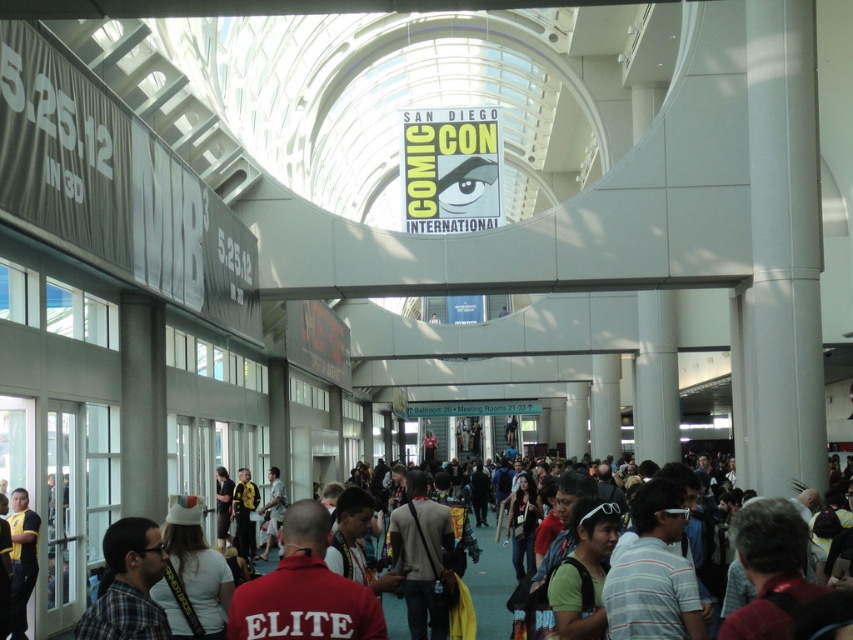
Who is positioned more to the right, plaid shirt at lower left or yellow jersey at center?

From the viewer's perspective, plaid shirt at lower left appears more on the right side.

Measure the distance from plaid shirt at lower left to yellow jersey at center.

They are 44.43 feet apart.

Measure the distance between plaid shirt at lower left and camera.

plaid shirt at lower left is 99.01 feet from camera.

Locate an element on the screen. plaid shirt at lower left is located at coordinates pos(128,586).

Is point (508, 554) in front of point (28, 550)?

No, (508, 554) is behind (28, 550).

In the scene shown: Does multicolored fabric crowd at center come behind yellow jersey at center?

No, multicolored fabric crowd at center is in front of yellow jersey at center.

You are a GUI agent. You are given a task and a screenshot of the screen. Output one action in this format:
    pyautogui.click(x=<x>, y=<y>)
    Task: Click on the multicolored fabric crowd at center
    The width and height of the screenshot is (853, 640).
    Given the screenshot: What is the action you would take?
    pyautogui.click(x=490, y=586)

Looking at this image, which of these two, plaid shirt at lower left or multicolored fabric crowd at center, stands taller?

With more height is multicolored fabric crowd at center.

Who is more distant from viewer, (107, 605) or (482, 556)?

Point (482, 556)

At what (x,y) coordinates should I click in order to perform the action: click on plaid shirt at lower left. Please return your answer as a coordinate pair (x, y). The image size is (853, 640). Looking at the image, I should click on (128, 586).